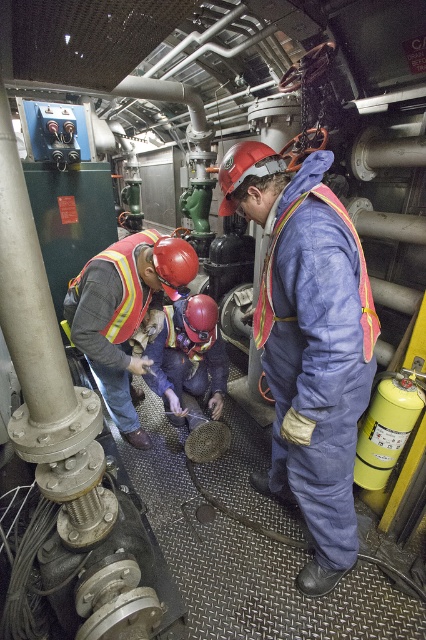
Does blue coveralls at center appear on the right side of reflective orange safety vest at center?

Indeed, blue coveralls at center is positioned on the right side of reflective orange safety vest at center.

Is blue coveralls at center above reflective orange safety vest at center?

No, blue coveralls at center is not above reflective orange safety vest at center.

Where is `blue coveralls at center`? blue coveralls at center is located at coordinates (308, 344).

Can you confirm if reflective orange safety vest at center is wider than reflective yellow safety vest at lower left?

Yes.

Which of these two, reflective orange safety vest at center or reflective yellow safety vest at lower left, stands taller?

reflective orange safety vest at center

Image resolution: width=426 pixels, height=640 pixels. What do you see at coordinates (124, 312) in the screenshot?
I see `reflective orange safety vest at center` at bounding box center [124, 312].

This screenshot has width=426, height=640. In order to click on reflective orange safety vest at center in this screenshot , I will do `click(124, 312)`.

Looking at this image, does blue coveralls at center have a greater width compared to reflective yellow safety vest at lower left?

Yes, blue coveralls at center is wider than reflective yellow safety vest at lower left.

Is point (264, 272) positioned in front of point (126, 300)?

Yes, point (264, 272) is in front of point (126, 300).

Identify the location of blue coveralls at center. (308, 344).

Identify the location of blue coveralls at center. Image resolution: width=426 pixels, height=640 pixels. (308, 344).